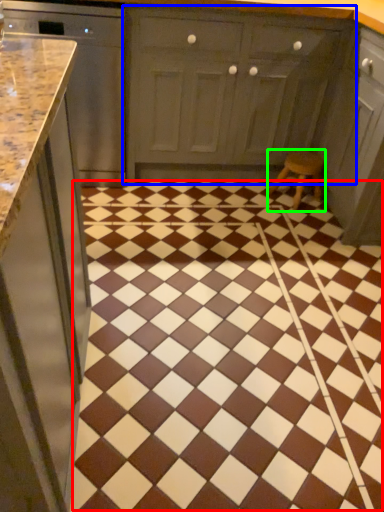
Question: Considering the real-world distances, which object is farthest from ceramic tile (highlighted by a red box)? cabinetry (highlighted by a blue box) or stool (highlighted by a green box)?

Choices:
 (A) cabinetry
 (B) stool

Answer: (A)